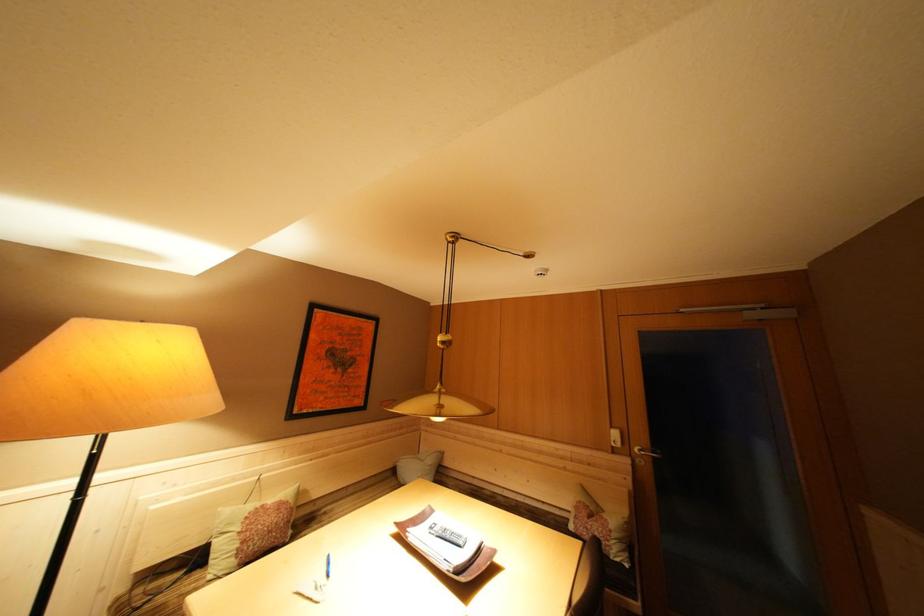
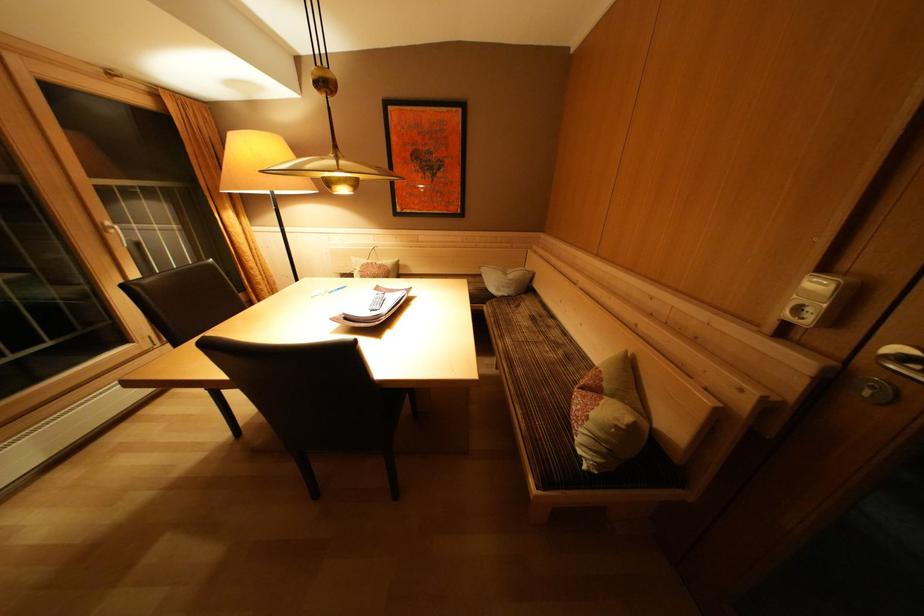
Find the pixel in the second image that matches [271,511] in the first image.

(379, 268)